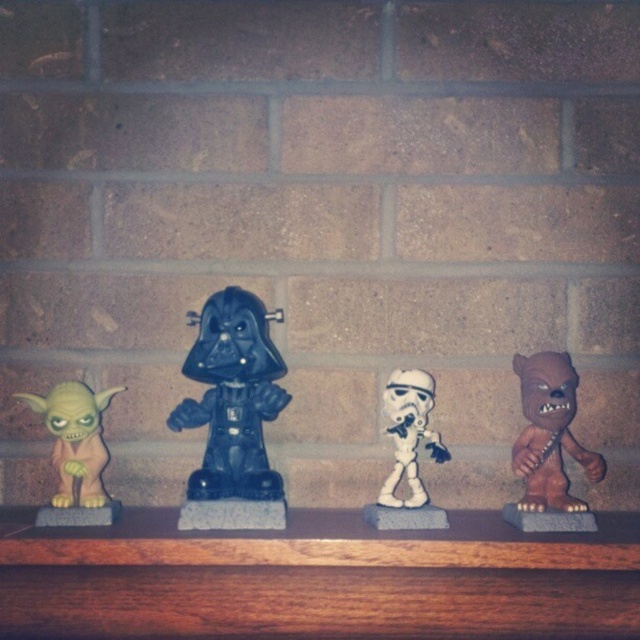
Which is more to the left, brown matte chewbacca at right or white matte stormtrooper helmet at center?

From the viewer's perspective, white matte stormtrooper helmet at center appears more on the left side.

Who is more forward, (x=548, y=362) or (x=388, y=413)?

Point (x=548, y=362)

Locate an element on the screen. brown matte chewbacca at right is located at coordinates (548, 433).

Measure the distance between matte black figure at center and light brown rubber toy at left.

3.26 inches

Is point (280, 356) behind point (93, 449)?

Yes.

Who is more forward, (272, 381) or (92, 408)?

Positioned in front is point (272, 381).

The height and width of the screenshot is (640, 640). What are the coordinates of `matte black figure at center` in the screenshot? It's located at (232, 413).

Does brown wood shelf at center have a greater height compared to white matte stormtrooper helmet at center?

No, brown wood shelf at center is not taller than white matte stormtrooper helmet at center.

Is brown wood shelf at center wider than white matte stormtrooper helmet at center?

Indeed, brown wood shelf at center has a greater width compared to white matte stormtrooper helmet at center.

Is point (333, 634) in front of point (397, 378)?

Yes, point (333, 634) is closer to viewer.

Locate an element on the screen. brown wood shelf at center is located at coordinates (317, 579).